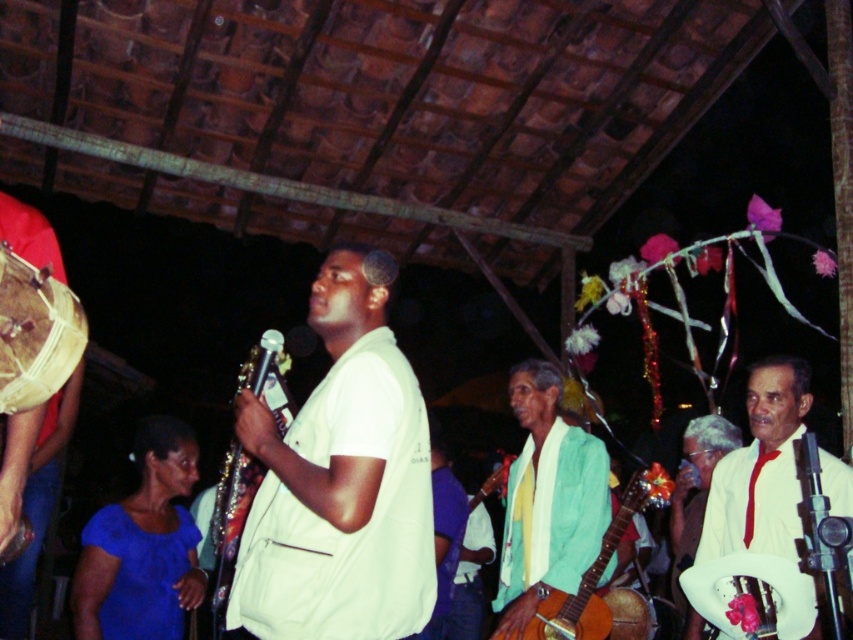
You are standing at the back of the event venue and see both the white fabric drum at lower right and the white satin hat at lower right. Which object is closer to the center of the image?

The white fabric drum at lower right is closer to the center because it is positioned to the left of the white satin hat at lower right, meaning it is nearer to the central area of the image.

In the scene shown: You are a photographer at the event and want to capture a clear shot of both the black metallic microphone at center and the white satin hat at lower right. However, you notice that the microphone is blocking part of the hat. To ensure both are fully visible in your photo, which object should you move closer to the camera?

The black metallic microphone at center is behind the white satin hat at lower right, so to ensure both are fully visible, you should move the black metallic microphone at center closer to the camera so it doesn